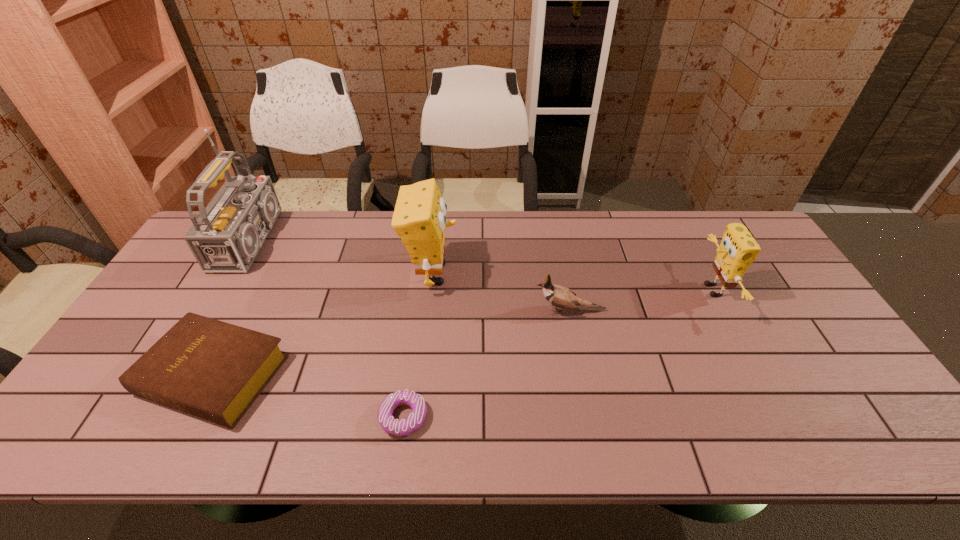
Identify the location of radio receiver. (228, 234).

Identify the location of the fifth shortest object. (419, 220).

In order to click on the left sponge in this screenshot , I will do `click(419, 220)`.

At what (x,y) coordinates should I click in order to perform the action: click on the fourth shortest object. Please return your answer as a coordinate pair (x, y). The image size is (960, 540). Looking at the image, I should click on (738, 249).

The image size is (960, 540). In order to click on the shorter sponge in this screenshot , I will do [x=738, y=249].

Where is `the second object from right to left`? The height and width of the screenshot is (540, 960). the second object from right to left is located at coordinates (559, 296).

At what (x,y) coordinates should I click in order to perform the action: click on the third shortest object. Please return your answer as a coordinate pair (x, y). This screenshot has width=960, height=540. Looking at the image, I should click on (559, 296).

You are a GUI agent. You are given a task and a screenshot of the screen. Output one action in this format:
    pyautogui.click(x=<x>, y=<y>)
    Task: Click on the second shortest object
    
    Given the screenshot: What is the action you would take?
    pyautogui.click(x=214, y=370)

Locate an element on the screen. the shortest object is located at coordinates pos(404,427).

Where is `vacant space located on the front-facing side of the radio receiver`? This screenshot has height=540, width=960. vacant space located on the front-facing side of the radio receiver is located at coordinates (374, 240).